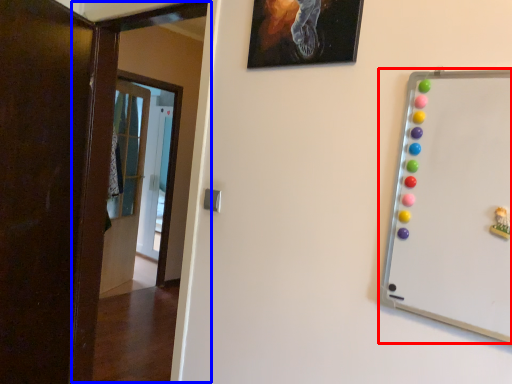
Question: Among these objects, which one is nearest to the camera, whiteboard (highlighted by a red box) or door (highlighted by a blue box)?

Choices:
 (A) whiteboard
 (B) door

Answer: (A)